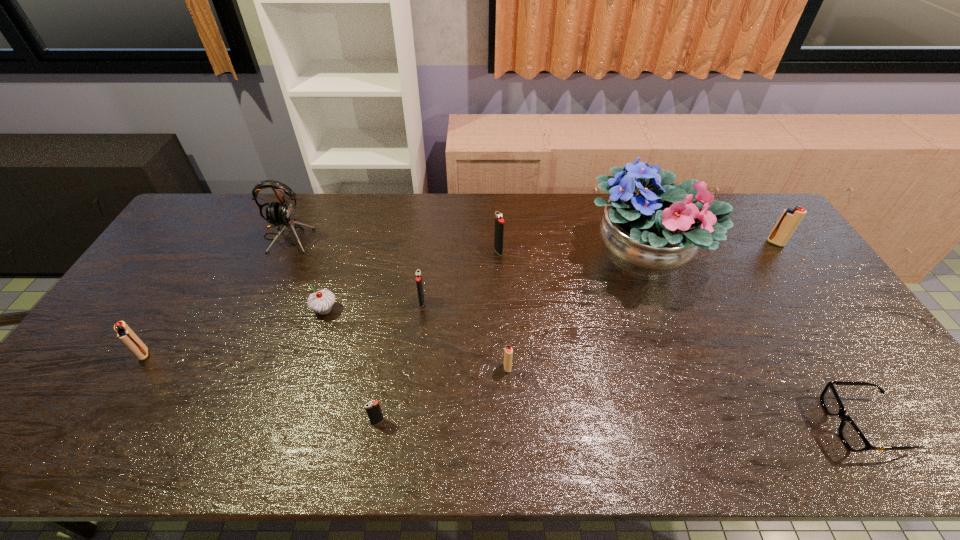
Where is `free location at the far edge`? free location at the far edge is located at coordinates (415, 219).

In the image, there is a desktop. Where is `vacant space at the near edge`? This screenshot has height=540, width=960. vacant space at the near edge is located at coordinates (760, 442).

At what (x,y) coordinates should I click in order to perform the action: click on free spot at the left edge of the desktop. Please return your answer as a coordinate pair (x, y). Looking at the image, I should click on (132, 382).

The height and width of the screenshot is (540, 960). I want to click on vacant space at the right edge of the desktop, so click(x=823, y=307).

This screenshot has width=960, height=540. I want to click on vacant area at the near left corner, so click(x=47, y=445).

Locate an element on the screen. free space between the shortest object and the nearest igniter is located at coordinates (620, 423).

Locate an element on the screen. This screenshot has height=540, width=960. vacant space that's between the second smallest red igniter and the smallest red igniter is located at coordinates (325, 361).

You are a GUI agent. You are given a task and a screenshot of the screen. Output one action in this format:
    pyautogui.click(x=<x>, y=<y>)
    Task: Click on the vacant area that lies between the black earphone and the cupcake
    The width and height of the screenshot is (960, 540).
    Given the screenshot: What is the action you would take?
    pyautogui.click(x=306, y=274)

At what (x,y) coordinates should I click in order to perform the action: click on blank region between the second smallest black igniter and the tallest object. Please return your answer as a coordinate pair (x, y). The image size is (960, 540). Looking at the image, I should click on coord(533,280).

Image resolution: width=960 pixels, height=540 pixels. Find the location of `free space between the second red igniter from left to right and the third nearest igniter`. free space between the second red igniter from left to right and the third nearest igniter is located at coordinates (325, 361).